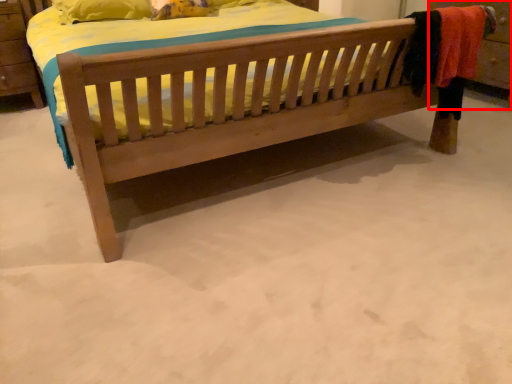
Question: From the image, what is the correct spatial relationship of dresser (annotated by the red box) in relation to bed?

Choices:
 (A) left
 (B) right

Answer: (B)